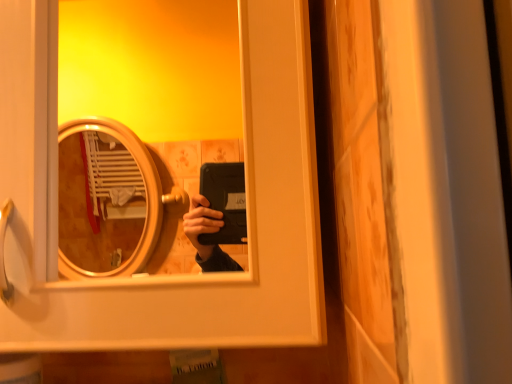
What do you see at coordinates (172, 276) in the screenshot? Image resolution: width=512 pixels, height=384 pixels. I see `matte wood medicine cabinet at upper center` at bounding box center [172, 276].

Where is `matte wood medicine cabinet at upper center`? The height and width of the screenshot is (384, 512). matte wood medicine cabinet at upper center is located at coordinates (172, 276).

The height and width of the screenshot is (384, 512). What are the coordinates of `matte wood medicine cabinet at upper center` in the screenshot? It's located at (172, 276).